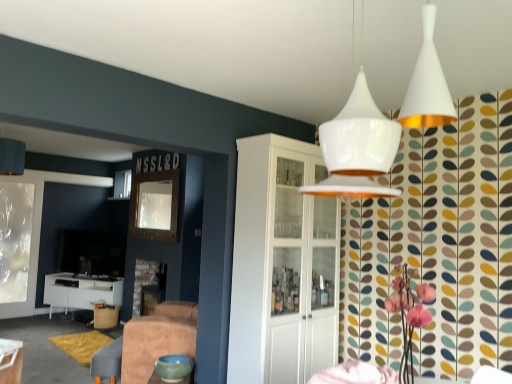
The width and height of the screenshot is (512, 384). What do you see at coordinates (173, 367) in the screenshot?
I see `matte green bowl at lower center` at bounding box center [173, 367].

At what (x,y) coordinates should I click in order to perform the action: click on matte green bowl at lower center. Please return your answer as a coordinate pair (x, y). Looking at the image, I should click on 173,367.

The width and height of the screenshot is (512, 384). What do you see at coordinates (11, 361) in the screenshot? I see `white glossy table at lower left, which appears as the first table when viewed from the front` at bounding box center [11, 361].

In order to face burlap stool at lower left, should I rotate leftwards or rightwards?

Rotate your view left by about 19.393°.

What do you see at coordinates (105, 316) in the screenshot? The width and height of the screenshot is (512, 384). I see `burlap stool at lower left` at bounding box center [105, 316].

The height and width of the screenshot is (384, 512). What are the coordinates of `white glossy table at lower left, which is the first table from left to right` in the screenshot? It's located at (80, 291).

You are a GUI agent. You are given a task and a screenshot of the screen. Output one action in this format:
    pyautogui.click(x=<x>, y=<y>)
    Task: Click on the matte green bowl at lower center
    
    Given the screenshot: What is the action you would take?
    pyautogui.click(x=173, y=367)

From a real-world perspective, which object stands above the other?

white glossy table at lower left, the 2th table from the back, from a real-world perspective.

Looking at this image, is burlap stool at lower left aimed at white glossy table at lower left, the 2th table viewed from the left?

No, burlap stool at lower left is not turned towards white glossy table at lower left, the 2th table viewed from the left.

Which of these two, burlap stool at lower left or white glossy table at lower left, which appears as the first table when viewed from the front, is smaller?

Smaller between the two is white glossy table at lower left, which appears as the first table when viewed from the front.

Image resolution: width=512 pixels, height=384 pixels. I want to click on bar stool that is behind the white glossy table at lower left, the 2th table viewed from the left, so click(x=105, y=316).

Considering the positions of objects matte green bowl at lower center and white glossy table at lower left, which ranks as the 1th table in bottom-to-top order, in the image provided, who is behind, matte green bowl at lower center or white glossy table at lower left, which ranks as the 1th table in bottom-to-top order,?

white glossy table at lower left, which ranks as the 1th table in bottom-to-top order, is behind.

Identify the location of the 2nd table to the left of the matte green bowl at lower center, starting your count from the anchor. (80, 291).

Based on the photo, considering the sizes of objects matte green bowl at lower center and white glossy table at lower left, the 1th table from the back, in the image provided, who is bigger, matte green bowl at lower center or white glossy table at lower left, the 1th table from the back,?

white glossy table at lower left, the 1th table from the back, is bigger.

Which of these two, white glossy table at lower left, which is the first table from left to right, or white glossy table at lower left, the 2th table from the back, is smaller?

Smaller between the two is white glossy table at lower left, the 2th table from the back.

Is white glossy table at lower left, the 2th table when ordered from right to left, positioned behind white glossy table at lower left, the 2th table viewed from the left?

That is True.

Image resolution: width=512 pixels, height=384 pixels. I want to click on round table that appears below the white glossy cabinet at center (from the image's perspective), so tap(173, 367).

From a real-world perspective, which object rests below the other?

matte green bowl at lower center, from a real-world perspective.

From the image's perspective, is white glossy cabinet at center below matte green bowl at lower center?

No, from the image's perspective, white glossy cabinet at center is not below matte green bowl at lower center.

Could you tell me if white glossy cabinet at center is turned towards matte green bowl at lower center?

No.

From a real-world perspective, is white glossy cabinet at center under leather swivel chair at lower center?

No, from a real-world perspective, white glossy cabinet at center is not below leather swivel chair at lower center.

From the picture: Between white glossy cabinet at center and leather swivel chair at lower center, which one has less height?

With less height is leather swivel chair at lower center.

Is white glossy cabinet at center far away from leather swivel chair at lower center?

white glossy cabinet at center is positioned a significant distance from leather swivel chair at lower center.

What's the angular difference between white glossy cabinet at center and leather swivel chair at lower center's facing directions?

The angle between the facing direction of white glossy cabinet at center and the facing direction of leather swivel chair at lower center is 140 degrees.

Does white glossy table at lower left, the 2th table from the back, have a lesser width compared to matte green bowl at lower center?

Indeed, white glossy table at lower left, the 2th table from the back, has a lesser width compared to matte green bowl at lower center.

Is white glossy table at lower left, which appears as the first table when viewed from the front, completely or partially outside of matte green bowl at lower center?

white glossy table at lower left, which appears as the first table when viewed from the front, is positioned outside matte green bowl at lower center.

From the image's perspective, which is above, white glossy table at lower left, the 1th table viewed from the right, or matte green bowl at lower center?

white glossy table at lower left, the 1th table viewed from the right.

Considering the relative sizes of white glossy table at lower left, which appears as the second table when viewed from the top, and matte green bowl at lower center in the image provided, is white glossy table at lower left, which appears as the second table when viewed from the top, taller than matte green bowl at lower center?

Indeed, white glossy table at lower left, which appears as the second table when viewed from the top, has a greater height compared to matte green bowl at lower center.

Considering the positions of point (64, 297) and point (165, 355), is point (64, 297) closer or farther from the camera than point (165, 355)?

Point (64, 297) is positioned farther from the camera compared to point (165, 355).

Between white glossy table at lower left, which ranks as the 2th table in front-to-back order, and matte green bowl at lower center, which one is positioned behind?

white glossy table at lower left, which ranks as the 2th table in front-to-back order, is further away from the camera.

Image resolution: width=512 pixels, height=384 pixels. I want to click on bar stool below the white glossy table at lower left, placed as the second table when sorted from bottom to top (from the image's perspective), so click(105, 316).

Starting from the matte green bowl at lower center, which table is the 2nd one to the left? Please provide its 2D coordinates.

[(80, 291)]

Estimate the real-world distances between objects in this image. Which object is closer to burlap stool at lower left, matte green bowl at lower center or white glossy table at lower left, which ranks as the 2th table in front-to-back order?

white glossy table at lower left, which ranks as the 2th table in front-to-back order, is positioned closer to the anchor burlap stool at lower left.

Looking at the image, which one is located further to leather swivel chair at lower center, white glossy cabinet at center or matte green bowl at lower center?

The object further to leather swivel chair at lower center is white glossy cabinet at center.

When comparing their distances from matte green bowl at lower center, does white glossy cabinet at center or white glossy table at lower left, the 1th table from the back, seem further?

white glossy table at lower left, the 1th table from the back, is further to matte green bowl at lower center.

Which object lies nearer to the anchor point leather swivel chair at lower center, burlap stool at lower left or white glossy cabinet at center?

burlap stool at lower left is positioned closer to the anchor leather swivel chair at lower center.

Looking at the image, which one is located further to matte green bowl at lower center, white glossy table at lower left, which is the first table from left to right, or burlap stool at lower left?

white glossy table at lower left, which is the first table from left to right.

Considering their positions, is leather swivel chair at lower center positioned further to burlap stool at lower left than white glossy table at lower left, the 1th table viewed from the right?

white glossy table at lower left, the 1th table viewed from the right, is further to burlap stool at lower left.

Considering their positions, is burlap stool at lower left positioned closer to matte green bowl at lower center than white glossy table at lower left, which is the first table from left to right?

burlap stool at lower left is positioned closer to the anchor matte green bowl at lower center.

When comparing their distances from white glossy cabinet at center, does white glossy table at lower left, which ranks as the 1th table in bottom-to-top order, or leather swivel chair at lower center seem closer?

leather swivel chair at lower center lies closer to white glossy cabinet at center than the other object.

This screenshot has width=512, height=384. In order to click on round table between white glossy cabinet at center and white glossy table at lower left, the 1th table from the back, from front to back in this screenshot , I will do `click(173, 367)`.

You are a GUI agent. You are given a task and a screenshot of the screen. Output one action in this format:
    pyautogui.click(x=<x>, y=<y>)
    Task: Click on the cabinetry between white glossy table at lower left, placed as the second table when sorted from bottom to top, and burlap stool at lower left, along the z-axis
    
    Given the screenshot: What is the action you would take?
    pyautogui.click(x=281, y=264)

Locate an element on the screen. The image size is (512, 384). bar stool located between white glossy cabinet at center and white glossy table at lower left, the 1th table from the back, in the depth direction is located at coordinates (105, 316).

I want to click on swivel chair positioned between white glossy table at lower left, the 2th table viewed from the left, and burlap stool at lower left from near to far, so click(x=106, y=361).